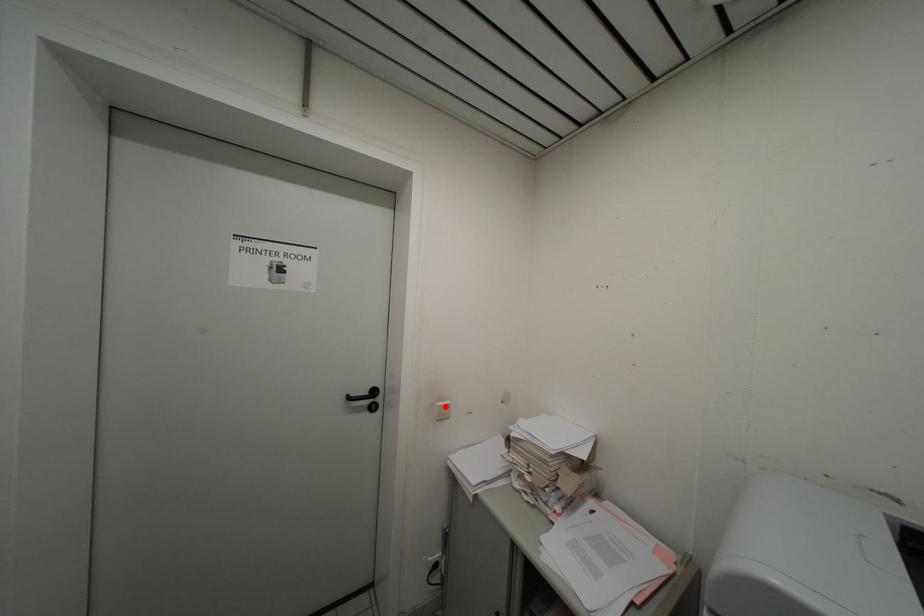
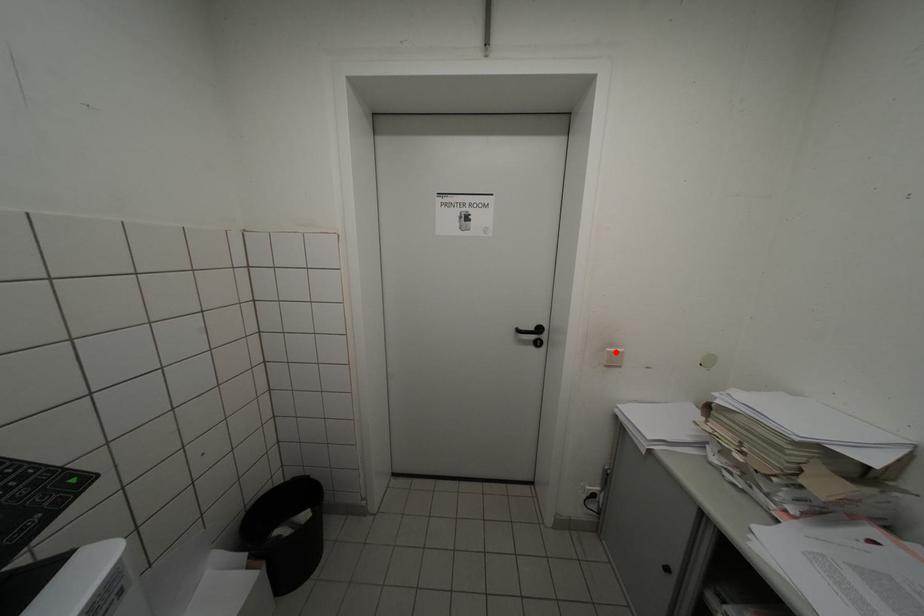
I am providing you with two images of the same scene from different viewpoints. A red point is marked on the first image and another point is marked on the second image. Is the red point in image1 aligned with the point shown in image2?

Yes